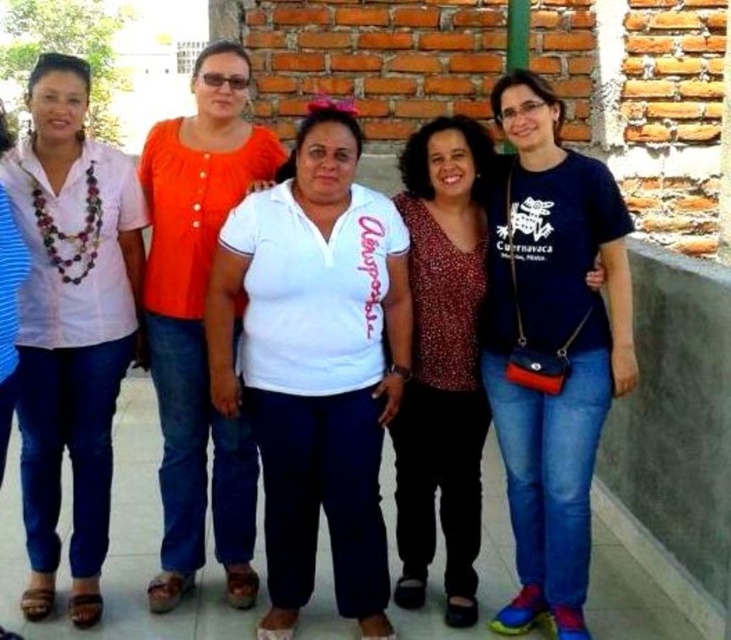
You are a photographer trying to adjust the lighting for the group photo. The lighting equipment is placed at point (71, 324). Which person in the group is directly under this point?

The point (71, 324) corresponds to the matte white blouse at left, so the first woman wearing a light pink shirt layered over a white blouse is directly under this point.